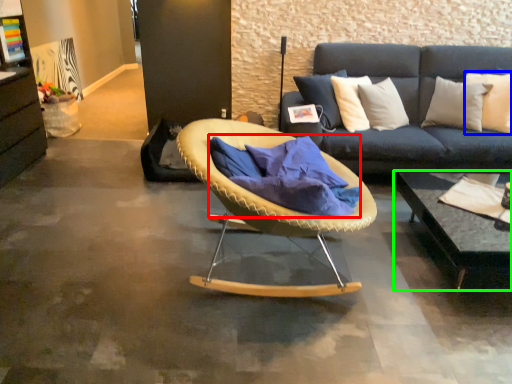
Question: Estimate the real-world distances between objects in this image. Which object is closer to blanket (highlighted by a red box), pillow (highlighted by a blue box) or coffee table (highlighted by a green box)?

Choices:
 (A) pillow
 (B) coffee table

Answer: (B)